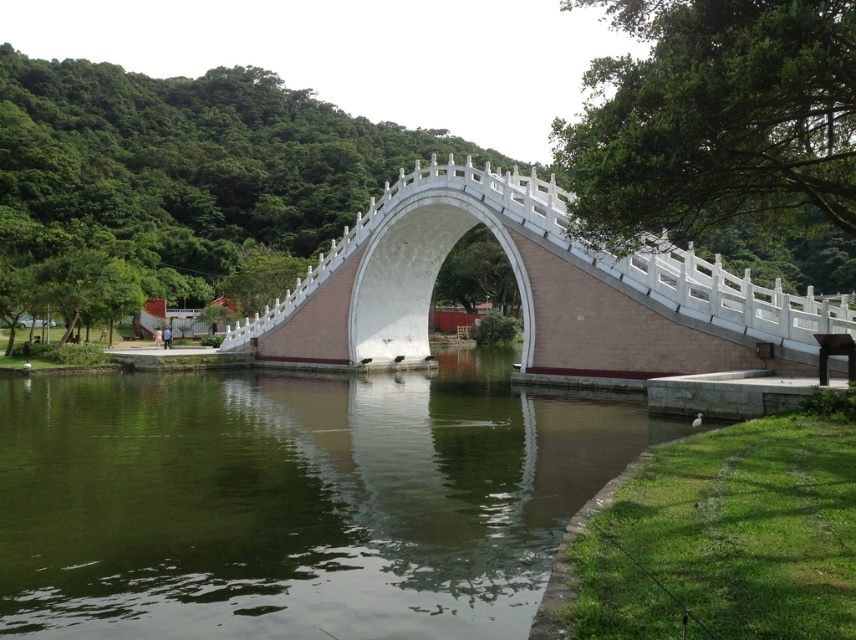
Question: Can you confirm if green smooth water at center is bigger than white stone bridge at center?

Choices:
 (A) yes
 (B) no

Answer: (B)

Question: Can you confirm if green smooth water at center is positioned to the right of white stone bridge at center?

Choices:
 (A) no
 (B) yes

Answer: (A)

Question: Which point is closer to the camera?

Choices:
 (A) (254, 396)
 (B) (608, 348)

Answer: (B)

Question: Does green smooth water at center appear under white stone bridge at center?

Choices:
 (A) no
 (B) yes

Answer: (B)